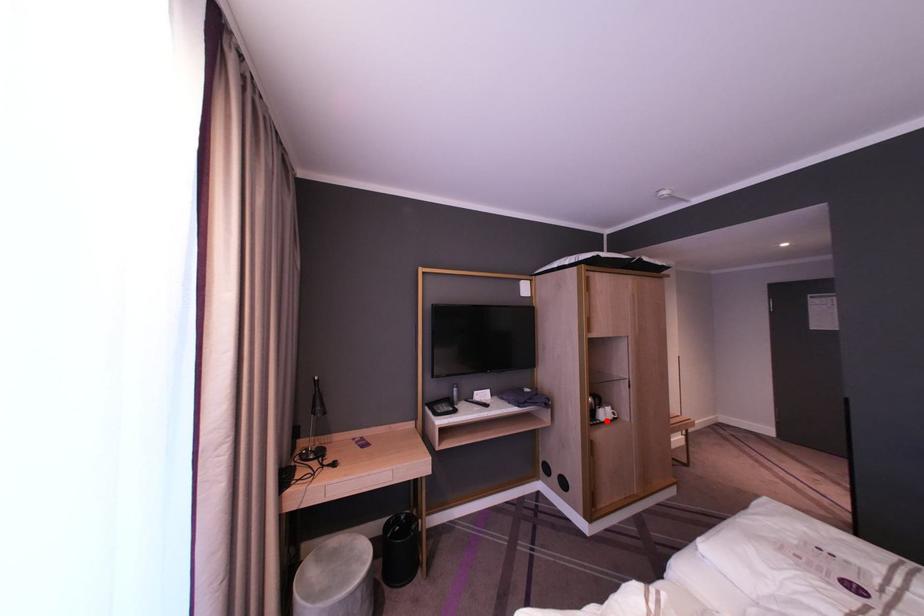
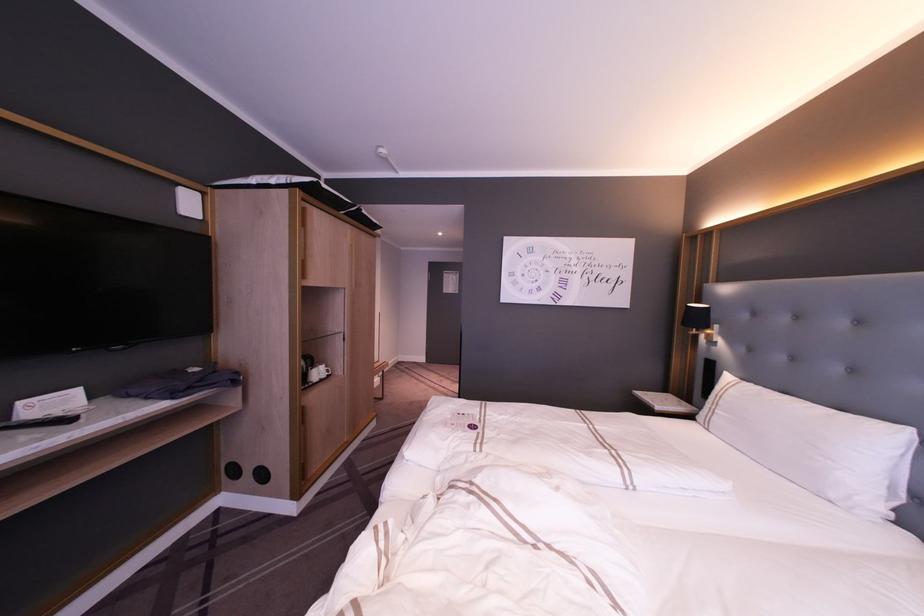
Question: I am providing you with two images of the same scene from different viewpoints. A red point is shown in image1. For the corresponding object point in image2, is it positioned nearer or farther from the camera?

Choices:
 (A) Nearer
 (B) Farther

Answer: (A)